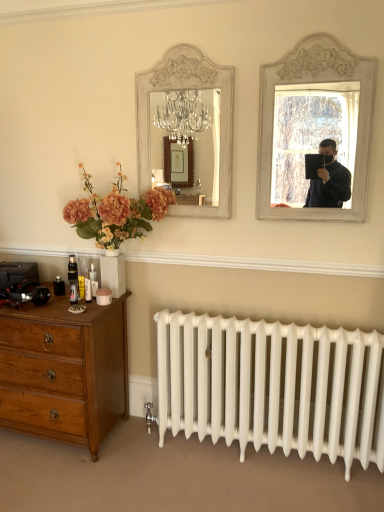
Question: From a real-world perspective, is wooden dresser at lower left positioned under white painted wood mirror at upper center based on gravity?

Choices:
 (A) yes
 (B) no

Answer: (A)

Question: Does wooden dresser at lower left have a lesser height compared to white painted wood mirror at upper center?

Choices:
 (A) no
 (B) yes

Answer: (B)

Question: Can you confirm if wooden dresser at lower left is thinner than white painted wood mirror at upper center?

Choices:
 (A) yes
 (B) no

Answer: (B)

Question: Is wooden dresser at lower left at the right side of white painted wood mirror at upper center?

Choices:
 (A) yes
 (B) no

Answer: (B)

Question: Does wooden dresser at lower left have a greater width compared to white painted wood mirror at upper center?

Choices:
 (A) yes
 (B) no

Answer: (A)

Question: Does wooden dresser at lower left come behind white painted wood mirror at upper center?

Choices:
 (A) no
 (B) yes

Answer: (A)

Question: Is the depth of wooden dresser at lower left greater than that of white painted wood mirror at upper right?

Choices:
 (A) yes
 (B) no

Answer: (A)

Question: Considering the relative positions of wooden dresser at lower left and white painted wood mirror at upper right in the image provided, is wooden dresser at lower left to the left of white painted wood mirror at upper right from the viewer's perspective?

Choices:
 (A) no
 (B) yes

Answer: (B)

Question: Is white painted wood mirror at upper right located within wooden dresser at lower left?

Choices:
 (A) yes
 (B) no

Answer: (B)

Question: Does wooden dresser at lower left come in front of white painted wood mirror at upper right?

Choices:
 (A) no
 (B) yes

Answer: (A)

Question: Does wooden dresser at lower left appear on the right side of white painted wood mirror at upper right?

Choices:
 (A) no
 (B) yes

Answer: (A)

Question: Is wooden dresser at lower left completely or partially outside of white painted wood mirror at upper right?

Choices:
 (A) no
 (B) yes

Answer: (B)

Question: Is white painted wood mirror at upper center aimed at wooden dresser at lower left?

Choices:
 (A) yes
 (B) no

Answer: (B)